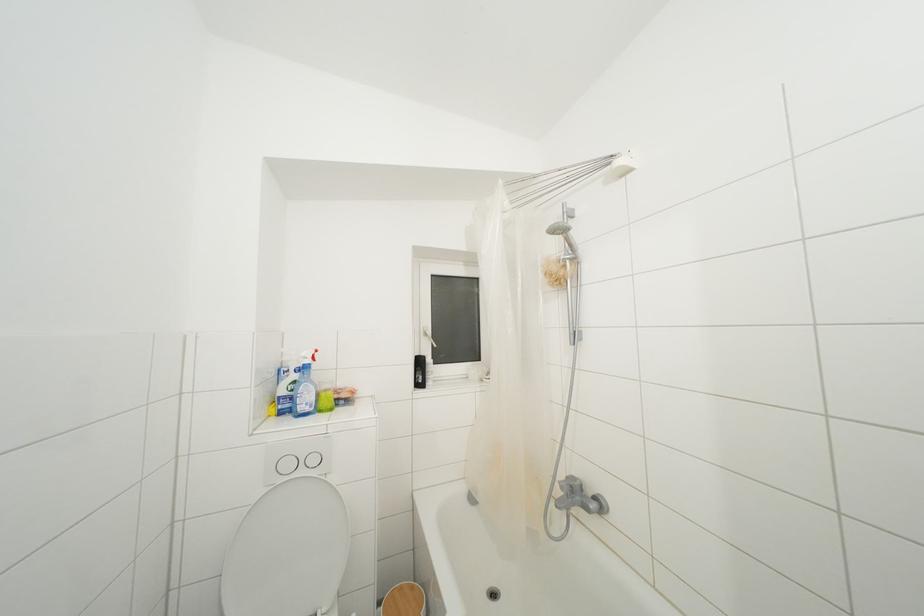
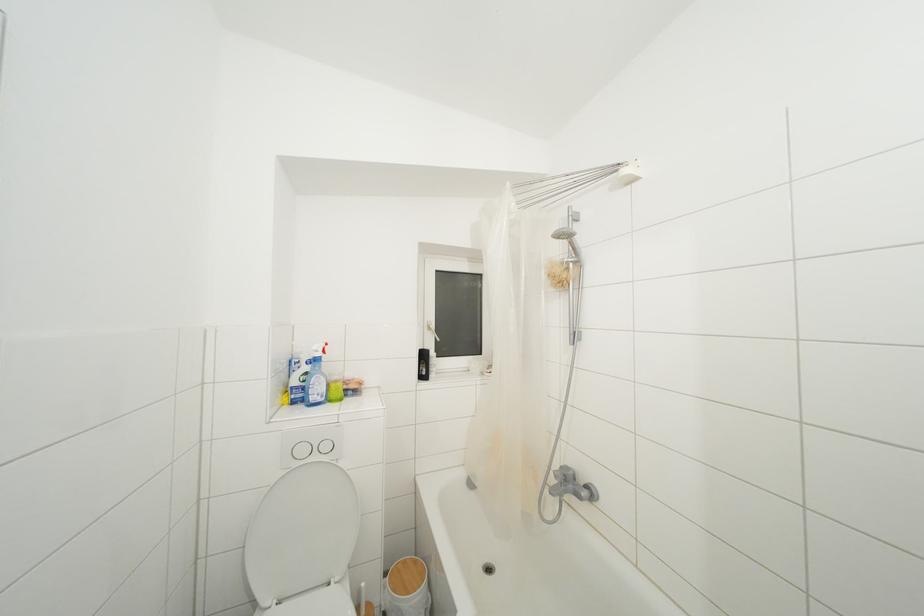
In the second image, find the point that corresponds to (x=575, y=251) in the first image.

(578, 254)